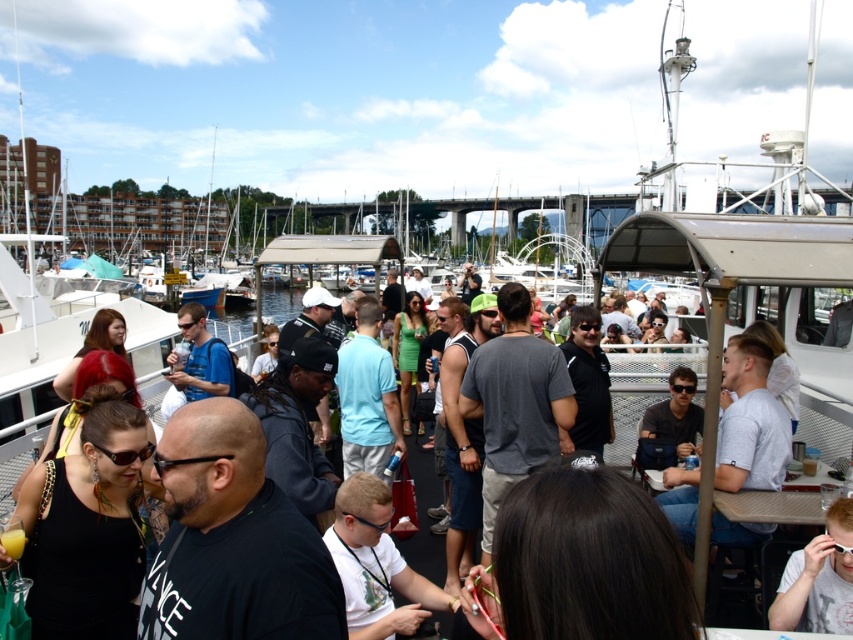
Question: Which object appears closest to the camera in this image?

Choices:
 (A) matte black sunglasses at center
 (B) black matte shirt at center
 (C) gray matte t-shirt at center
 (D) light brown wooden table at lower right

Answer: (B)

Question: Is white matte t-shirt at center below matte blue shirt at center?

Choices:
 (A) yes
 (B) no

Answer: (A)

Question: Which point is closer to the camera?

Choices:
 (A) white matte t-shirt at center
 (B) gray matte t-shirt at center

Answer: (A)

Question: Observing the image, what is the correct spatial positioning of gray matte t-shirt at center in reference to matte black sunglasses at center?

Choices:
 (A) below
 (B) above

Answer: (B)

Question: In this image, where is dark brown hair at lower center located relative to matte black sunglasses at center?

Choices:
 (A) right
 (B) left

Answer: (B)

Question: Which point is farther to the camera?

Choices:
 (A) (180, 387)
 (B) (175, 586)
 (C) (677, 433)

Answer: (A)